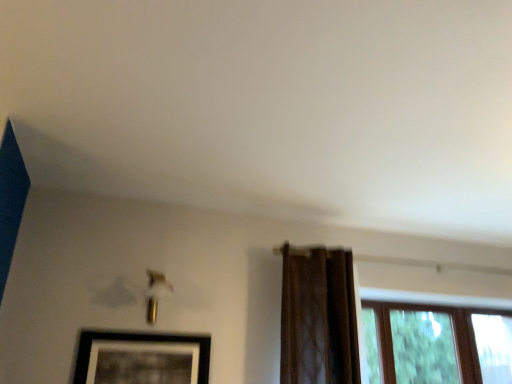
Question: From their relative heights in the image, would you say brown sheer curtain at right is taller or shorter than black matte picture frame at lower left?

Choices:
 (A) short
 (B) tall

Answer: (B)

Question: Which is correct: brown sheer curtain at right is inside black matte picture frame at lower left, or outside of it?

Choices:
 (A) inside
 (B) outside

Answer: (B)

Question: Is brown sheer curtain at right bigger or smaller than black matte picture frame at lower left?

Choices:
 (A) small
 (B) big

Answer: (B)

Question: Is black matte picture frame at lower left inside or outside of brown sheer curtain at right?

Choices:
 (A) inside
 (B) outside

Answer: (B)

Question: In the image, is black matte picture frame at lower left positioned in front of or behind brown sheer curtain at right?

Choices:
 (A) behind
 (B) front

Answer: (B)

Question: From the image's perspective, relative to brown sheer curtain at right, is black matte picture frame at lower left above or below?

Choices:
 (A) below
 (B) above

Answer: (A)

Question: Is point (195, 359) positioned closer to the camera than point (282, 326)?

Choices:
 (A) closer
 (B) farther

Answer: (A)